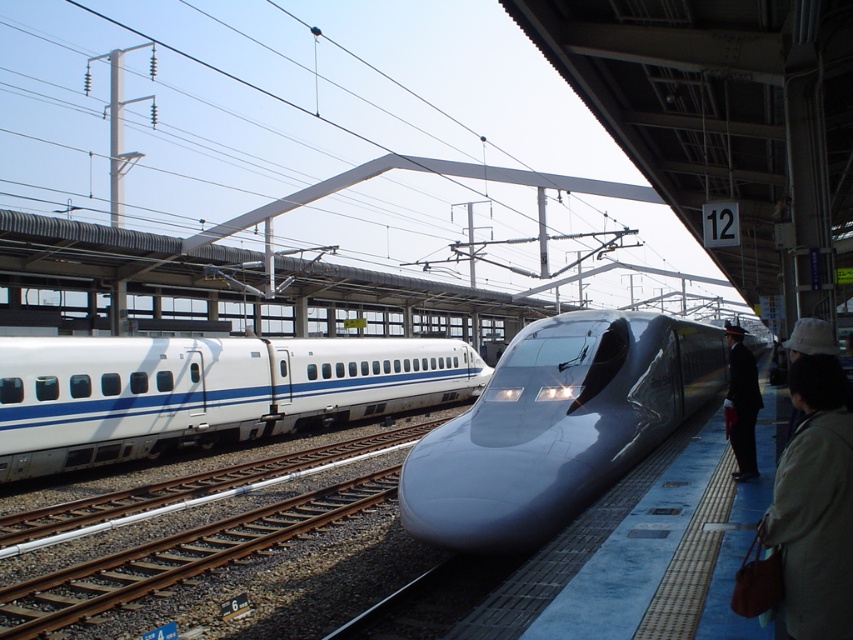
Question: Can you confirm if beige fabric coat at lower right is bigger than dark suit at platform right?

Choices:
 (A) yes
 (B) no

Answer: (B)

Question: Which point is closer to the camera taking this photo?

Choices:
 (A) (785, 561)
 (B) (560, 378)

Answer: (A)

Question: Which object is farther from the camera taking this photo?

Choices:
 (A) beige fabric coat at lower right
 (B) glossy metallic train at center
 (C) white glossy train at center

Answer: (C)

Question: Where is beige fabric coat at lower right located in relation to dark suit at platform right in the image?

Choices:
 (A) left
 (B) right

Answer: (A)

Question: Can you confirm if glossy metallic train at center is bigger than white glossy train at center?

Choices:
 (A) yes
 (B) no

Answer: (A)

Question: Among these points, which one is nearest to the camera?

Choices:
 (A) (741, 445)
 (B) (614, 356)

Answer: (A)